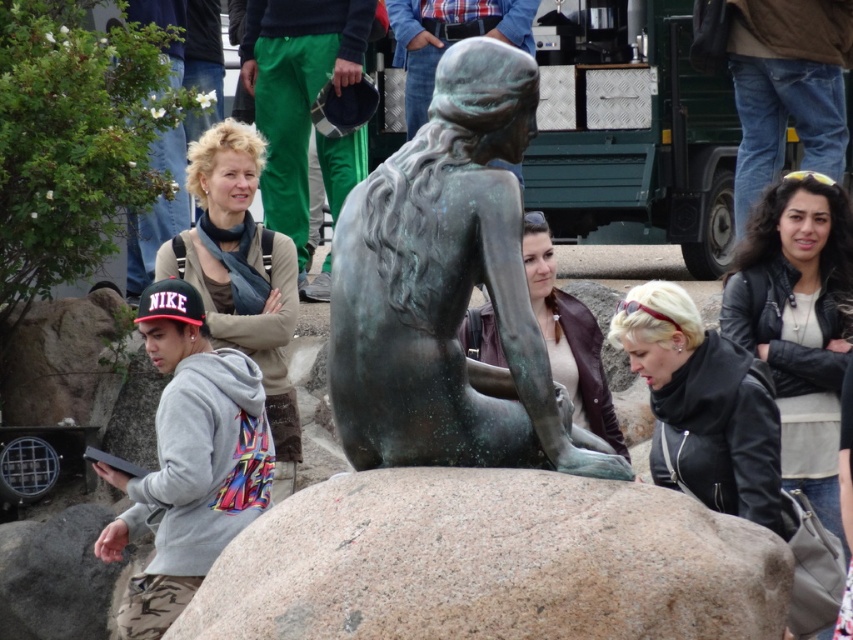
Question: Which of the following is the farthest from the observer?

Choices:
 (A) (585, 557)
 (B) (659, 472)
 (C) (824, 272)
 (D) (538, 236)

Answer: (C)

Question: Which point is farther to the camera?

Choices:
 (A) granite boulder at center
 (B) matte black jacket at lower right
 (C) green patina bronze statue at center
 (D) granite boulder at lower left

Answer: (D)

Question: Is leather jacket at right closer to camera compared to matte bronze statue at center?

Choices:
 (A) no
 (B) yes

Answer: (B)

Question: Observing the image, what is the correct spatial positioning of granite boulder at center in reference to granite boulder at lower left?

Choices:
 (A) right
 (B) left

Answer: (A)

Question: Is granite boulder at center further to camera compared to green patina bronze statue at center?

Choices:
 (A) no
 (B) yes

Answer: (A)

Question: Which of the following is the closest to the observer?

Choices:
 (A) granite boulder at center
 (B) matte black jacket at lower right
 (C) green patina bronze statue at center

Answer: (A)